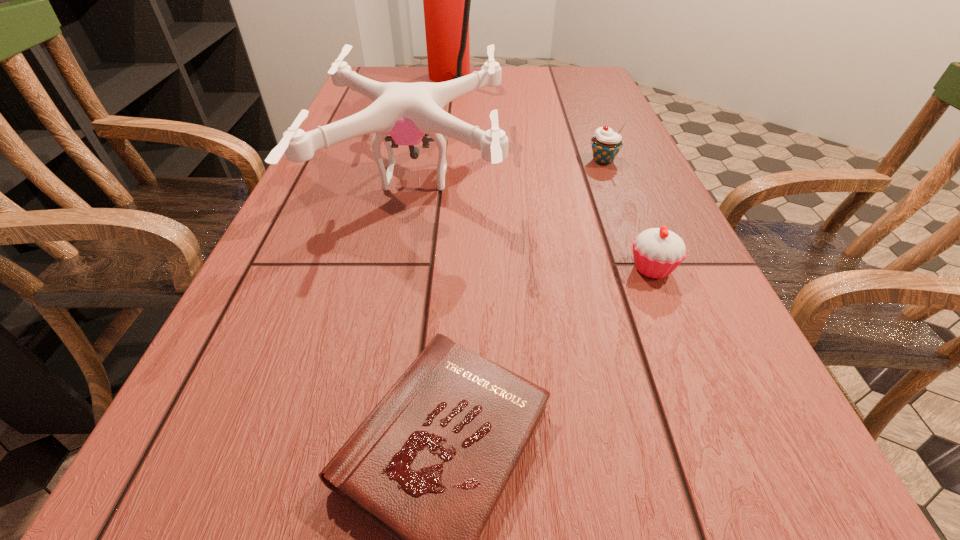
At what (x,y) coordinates should I click in order to perform the action: click on object at the far edge. Please return your answer as a coordinate pair (x, y). Looking at the image, I should click on (446, 0).

The image size is (960, 540). Find the location of `object situated at the left edge`. object situated at the left edge is located at coordinates (406, 111).

I want to click on vacant space at the left edge of the desktop, so click(x=291, y=372).

Locate an element on the screen. This screenshot has width=960, height=540. free region at the right edge is located at coordinates (564, 112).

In the image, there is a desktop. Where is `vacant region at the far left corner`? This screenshot has width=960, height=540. vacant region at the far left corner is located at coordinates (377, 82).

Where is `free space between the farther cupcake and the drone`? The image size is (960, 540). free space between the farther cupcake and the drone is located at coordinates (510, 168).

Where is `vacant space that is in between the farther cupcake and the fourth shortest object`? vacant space that is in between the farther cupcake and the fourth shortest object is located at coordinates (510, 168).

At what (x,y) coordinates should I click in order to perform the action: click on vacant space in between the fire extinguisher and the shorter cupcake. Please return your answer as a coordinate pair (x, y). This screenshot has width=960, height=540. Looking at the image, I should click on tap(551, 174).

Locate an element on the screen. The image size is (960, 540). unoccupied area between the taller cupcake and the second tallest object is located at coordinates (510, 168).

Identify the location of free space between the second shortest object and the third tallest object. (628, 214).